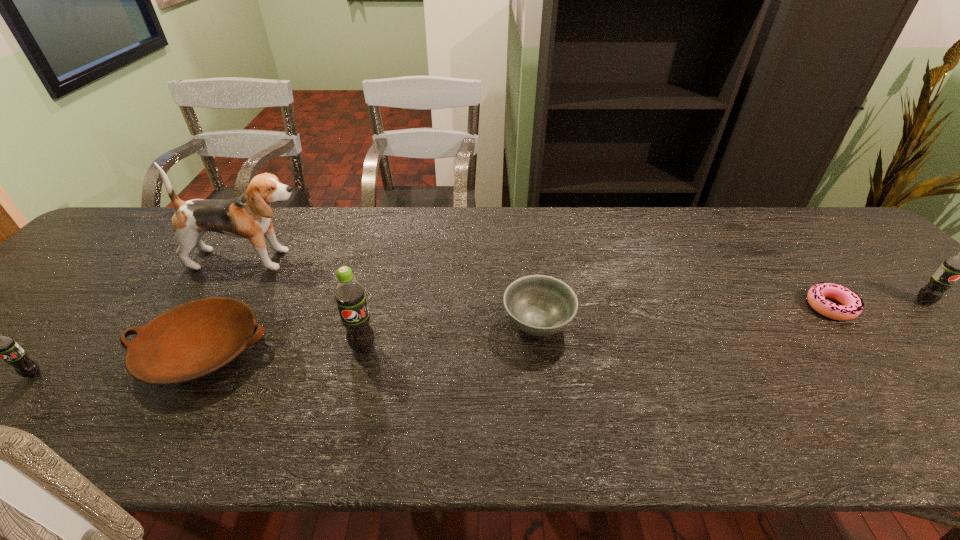
At what (x,y) coordinates should I click in order to perform the action: click on plate present at the near edge. Please return your answer as a coordinate pair (x, y). The width and height of the screenshot is (960, 540). Looking at the image, I should click on (195, 339).

At what (x,y) coordinates should I click in order to perform the action: click on object situated at the left edge. Please return your answer as a coordinate pair (x, y). The height and width of the screenshot is (540, 960). Looking at the image, I should click on (5, 347).

At what (x,y) coordinates should I click in order to perform the action: click on object that is at the right edge. Please return your answer as a coordinate pair (x, y). This screenshot has width=960, height=540. Looking at the image, I should click on (959, 266).

I want to click on object present at the near left corner, so click(x=5, y=347).

Locate an element on the screen. The image size is (960, 540). free space at the far edge of the desktop is located at coordinates (592, 244).

Where is `free region at the near edge of the desktop`? free region at the near edge of the desktop is located at coordinates (72, 402).

The width and height of the screenshot is (960, 540). In the image, there is a desktop. What are the coordinates of `vacant area at the left edge` in the screenshot? It's located at (69, 320).

Where is `vacant space at the right edge`? This screenshot has height=540, width=960. vacant space at the right edge is located at coordinates (914, 298).

In the image, there is a desktop. At what (x,y) coordinates should I click in order to perform the action: click on blank space at the far left corner. Please return your answer as a coordinate pair (x, y). The height and width of the screenshot is (540, 960). Looking at the image, I should click on (175, 212).

This screenshot has width=960, height=540. I want to click on vacant space that's between the rightmost soda and the bowl, so click(731, 313).